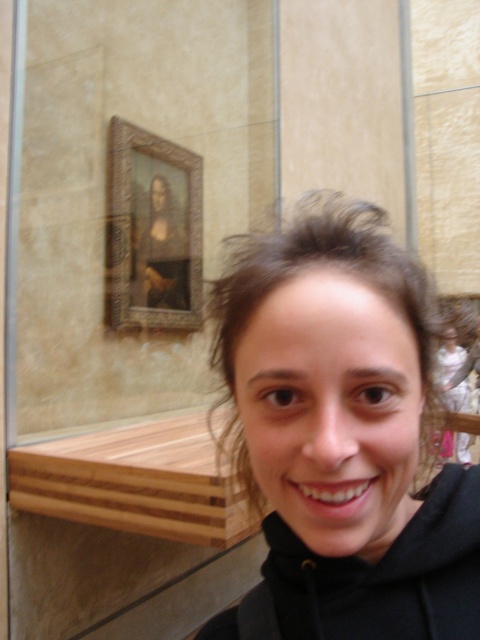
Question: Which of the following is the closest to the observer?

Choices:
 (A) matte black hoodie at center
 (B) black fleece sweatshirt at center

Answer: (A)

Question: Does matte black hoodie at center appear under black fleece sweatshirt at center?

Choices:
 (A) no
 (B) yes

Answer: (A)

Question: Considering the relative positions of matte black hoodie at center and black fleece sweatshirt at center in the image provided, where is matte black hoodie at center located with respect to black fleece sweatshirt at center?

Choices:
 (A) below
 (B) above

Answer: (B)

Question: Which point is farther from the camera taking this photo?

Choices:
 (A) (282, 616)
 (B) (394, 552)

Answer: (A)

Question: Can you confirm if matte black hoodie at center is thinner than black fleece sweatshirt at center?

Choices:
 (A) no
 (B) yes

Answer: (B)